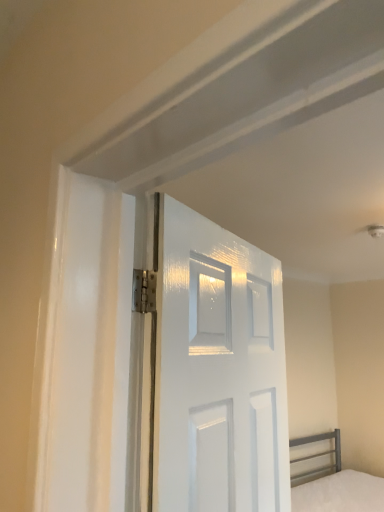
Question: Should I look upward or downward to see white glossy door at center?

Choices:
 (A) down
 (B) up

Answer: (A)

Question: Is white matte bed at lower right surrounded by white glossy door at center?

Choices:
 (A) no
 (B) yes

Answer: (A)

Question: Does white glossy door at center come in front of white matte bed at lower right?

Choices:
 (A) yes
 (B) no

Answer: (A)

Question: From a real-world perspective, is white glossy door at center positioned over white matte bed at lower right based on gravity?

Choices:
 (A) yes
 (B) no

Answer: (A)

Question: Is white glossy door at center beside white matte bed at lower right?

Choices:
 (A) yes
 (B) no

Answer: (B)

Question: Does white glossy door at center come behind white matte bed at lower right?

Choices:
 (A) no
 (B) yes

Answer: (A)

Question: Considering the relative sizes of white glossy door at center and white matte bed at lower right in the image provided, is white glossy door at center smaller than white matte bed at lower right?

Choices:
 (A) no
 (B) yes

Answer: (B)

Question: Is white matte bed at lower right bigger than white glossy door at center?

Choices:
 (A) yes
 (B) no

Answer: (A)

Question: Is white matte bed at lower right beside white glossy door at center?

Choices:
 (A) yes
 (B) no

Answer: (B)

Question: Are white matte bed at lower right and white glossy door at center located far from each other?

Choices:
 (A) yes
 (B) no

Answer: (A)

Question: From a real-world perspective, is white matte bed at lower right under white glossy door at center?

Choices:
 (A) no
 (B) yes

Answer: (B)

Question: Can you confirm if white matte bed at lower right is thinner than white glossy door at center?

Choices:
 (A) no
 (B) yes

Answer: (A)

Question: From a real-world perspective, does white matte bed at lower right stand above white glossy door at center?

Choices:
 (A) no
 (B) yes

Answer: (A)

Question: From a real-world perspective, is white matte bed at lower right physically located above or below white glossy door at center?

Choices:
 (A) above
 (B) below

Answer: (B)